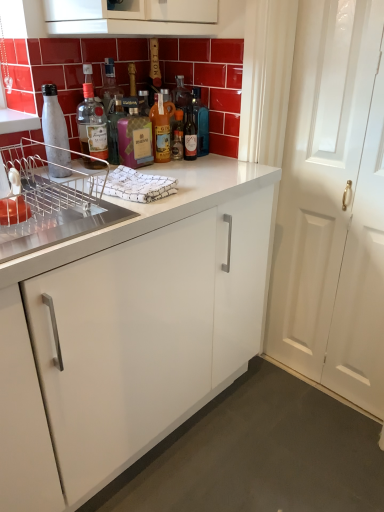
Question: From a real-world perspective, relative to white matte water bottle at left, which is the 6th bottle from right to left, is matte glass bottle at upper center, which is the fifth bottle in right-to-left order, vertically above or below?

Choices:
 (A) below
 (B) above

Answer: (B)

Question: Is point (100, 151) closer or farther from the camera than point (52, 103)?

Choices:
 (A) closer
 (B) farther

Answer: (B)

Question: Based on their relative distances, which object is farther from the pink glass bottle at center, the 3th bottle positioned from the left?

Choices:
 (A) white wooden door at right
 (B) matte glass bottle at center, the third bottle from the right
 (C) white matte water bottle at left, which is the first bottle from left to right
 (D) translucent glass bottle at center, placed as the first bottle when sorted from right to left
 (E) metallic silver dish rack at left

Answer: (A)

Question: Estimate the real-world distances between objects in this image. Which object is farther from the translucent glass bottle at center, the fifth bottle in the left-to-right sequence?

Choices:
 (A) translucent glass bottle at center, the sixth bottle from the left
 (B) matte glass bottle at upper center, which is the second bottle from left to right
 (C) matte glass bottle at center, the third bottle from the right
 (D) metallic silver dish rack at left
 (E) white matte water bottle at left, which is the 6th bottle from right to left

Answer: (D)